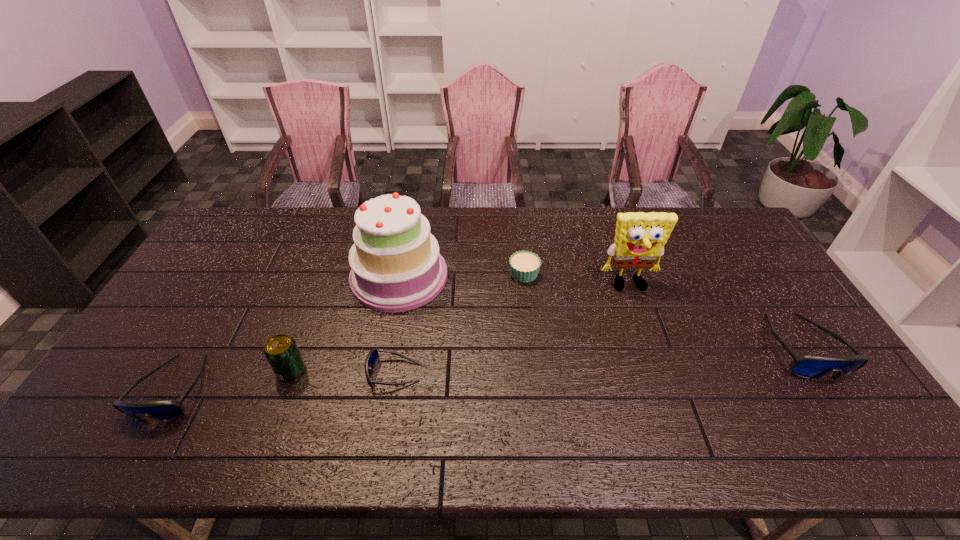
Find the location of `the leftmost sunglasses`. the leftmost sunglasses is located at coordinates (164, 410).

This screenshot has width=960, height=540. What are the coordinates of `the fifth tallest object` in the screenshot? It's located at (164, 410).

Where is `the second sunglasses from left to right`? The image size is (960, 540). the second sunglasses from left to right is located at coordinates (373, 356).

Identify the location of the rightmost sunglasses. (808, 366).

This screenshot has height=540, width=960. I want to click on the fifth object from left to right, so click(524, 266).

Identify the location of cake. The height and width of the screenshot is (540, 960). (396, 266).

Identify the location of the sixth object from left to right. The width and height of the screenshot is (960, 540). (640, 237).

Where is `beer can`? beer can is located at coordinates (281, 351).

The height and width of the screenshot is (540, 960). Find the location of `the third tallest object`. the third tallest object is located at coordinates (281, 351).

Identify the location of blank area located 0.180m on the front-facing side of the second sunglasses from right to left. The height and width of the screenshot is (540, 960). (300, 373).